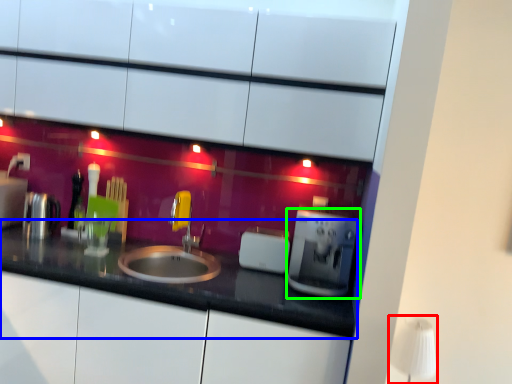
Question: Which is farther away from table lamp (highlighted by a red box)? countertop (highlighted by a blue box) or coffee machine (highlighted by a green box)?

Choices:
 (A) countertop
 (B) coffee machine

Answer: (A)